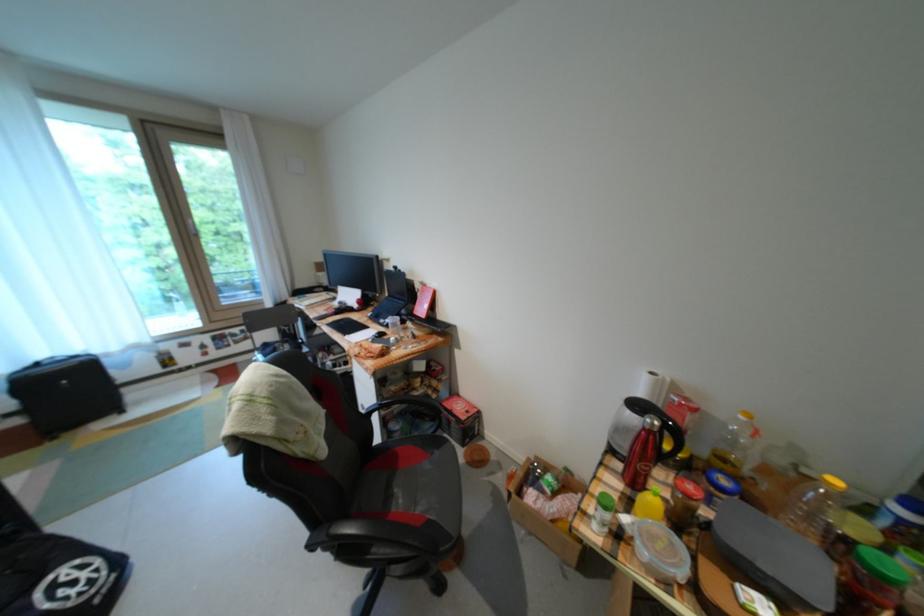
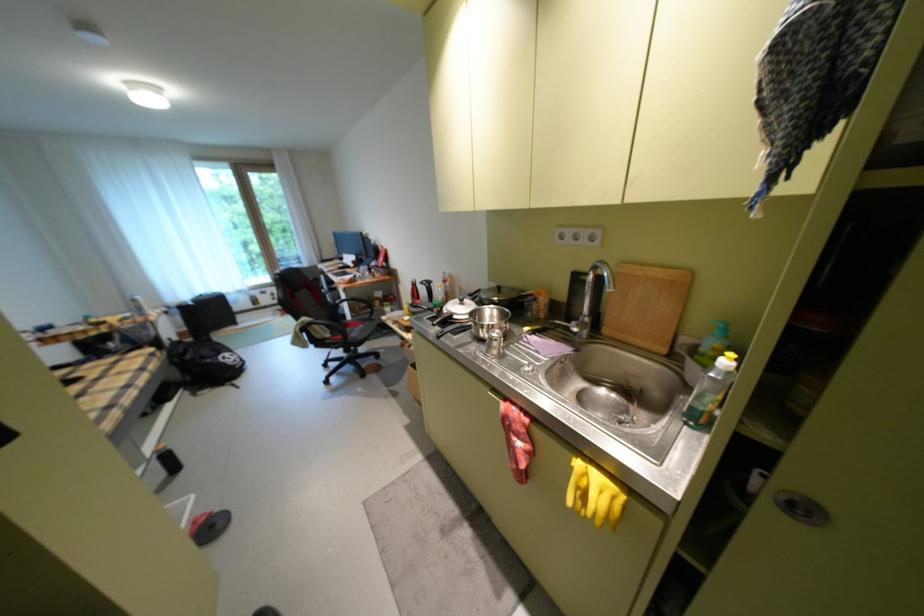
Locate, in the second image, the point that corresponds to point 84,576 in the first image.

(239, 358)